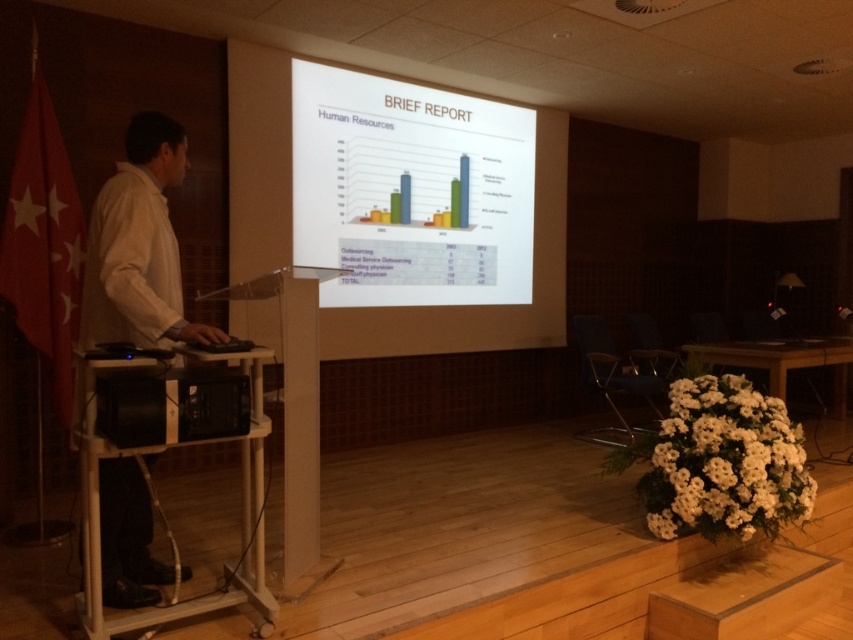
You are an attendee at the presentation and want to take a photo of the white glossy projector screen at upper center and the white shirt at left. Which object will appear bigger in your photo?

The white glossy projector screen at upper center will appear bigger in your photo because it is larger in size than the white shirt at left.

You are standing in the presentation room and see two points on the screen. The first point is at coordinates point (140, 317) and the second is at point (137, 372). Which point is closer to the bottom edge of the screen?

Point (140, 317) is behind point (137, 372), so the second point is closer to the bottom edge of the screen.